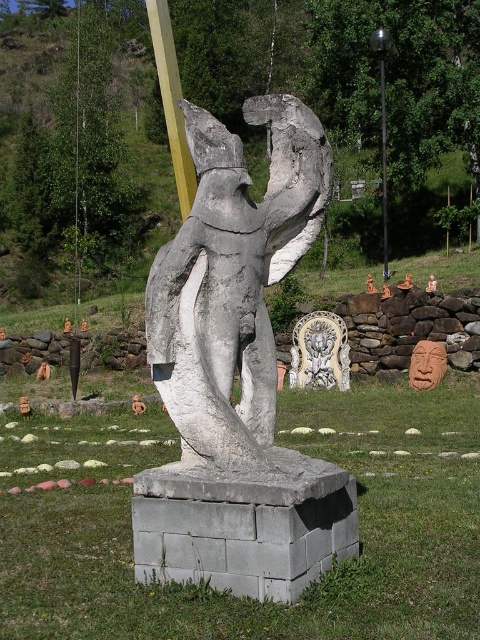
From the picture: You are a maintenance worker needing to reach the metallic pole at upper center from the gray concrete statue at center. Given that your ladder is 15 meters long, will it be sufficient to reach the pole?

The gray concrete statue at center is 14.69 meters away from the metallic pole at upper center. Since the ladder is 15 meters long, it will be sufficient to reach the pole.

You are a painter standing at the edge of the grassy area. You want to paint both the gray concrete statue at center and the metallic pole at upper center. Which object should you focus on first if you want to paint the larger one first?

The metallic pole at upper center is larger than the gray concrete statue at center, so you should focus on painting the metallic pole at upper center first.